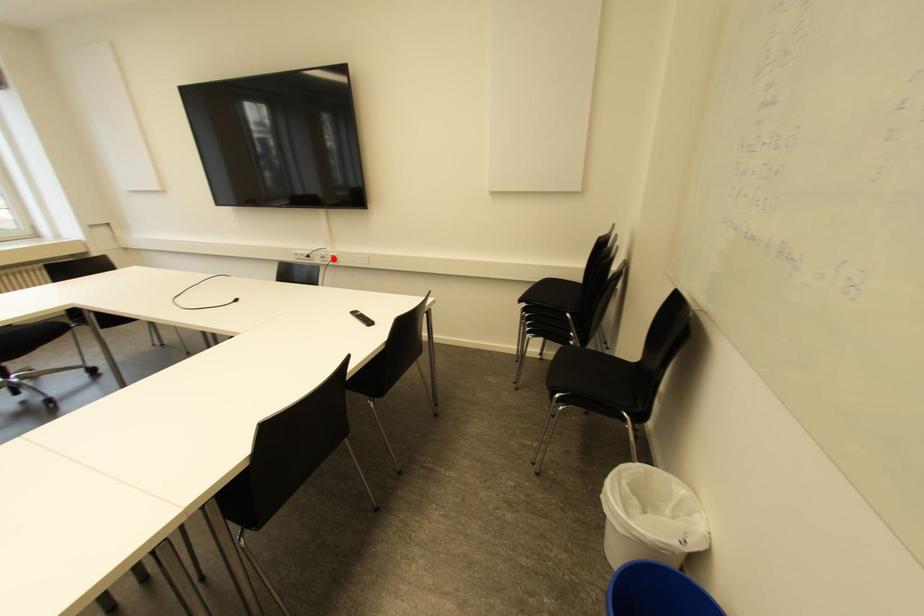
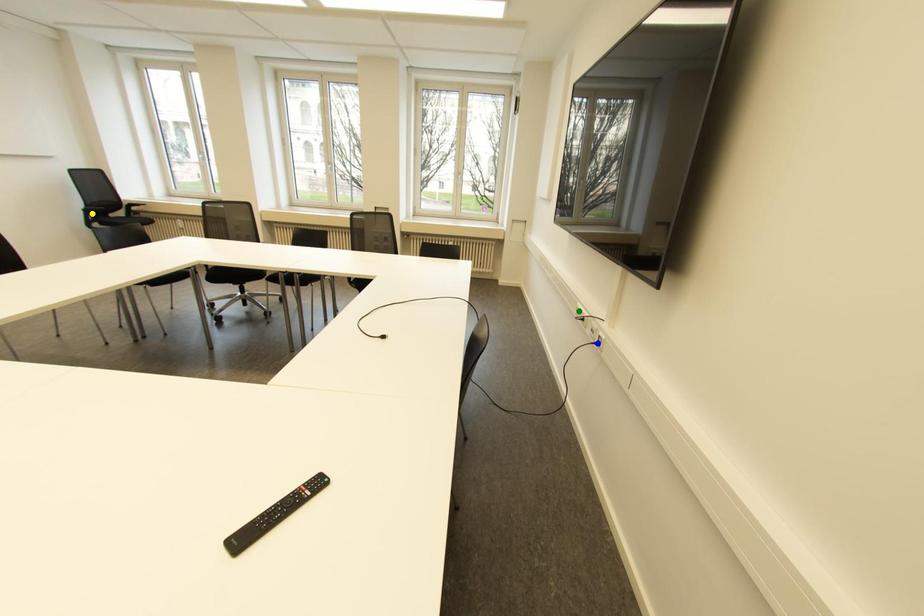
Question: I am providing you with two images of the same scene from different viewpoints. A red point is marked on the first image. You are given multiple points on the second image. Which point in image 2 represents the same 3d spot as the red point in image 1?

Choices:
 (A) green point
 (B) blue point
 (C) yellow point

Answer: (B)